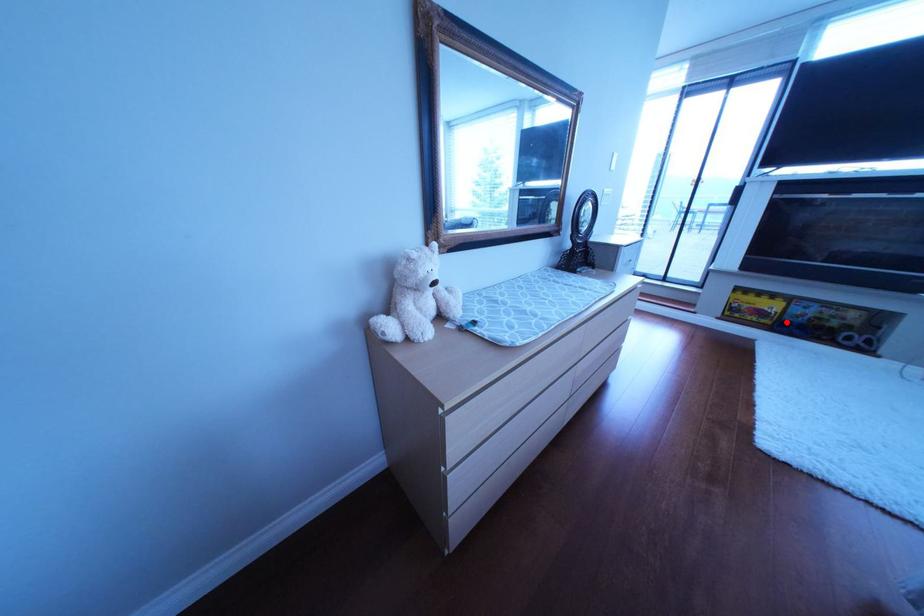
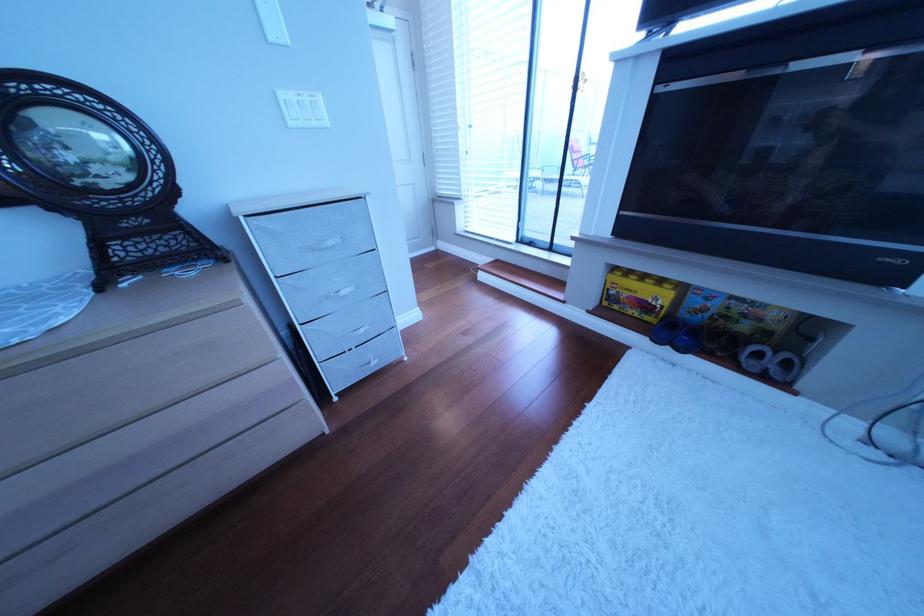
Question: A red point is marked in image1. In image2, is the corresponding 3D point closer to the camera or farther? Reply with the corresponding letter.

Choices:
 (A) The corresponding 3D point is closer.
 (B) The corresponding 3D point is farther.

Answer: (A)